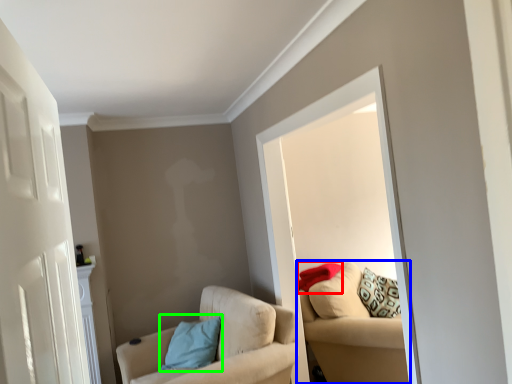
Question: Based on their relative distances, which object is nearer to pillow (highlighted by a red box)? Choose from studio couch (highlighted by a blue box) and pillow (highlighted by a green box).

Choices:
 (A) studio couch
 (B) pillow

Answer: (A)